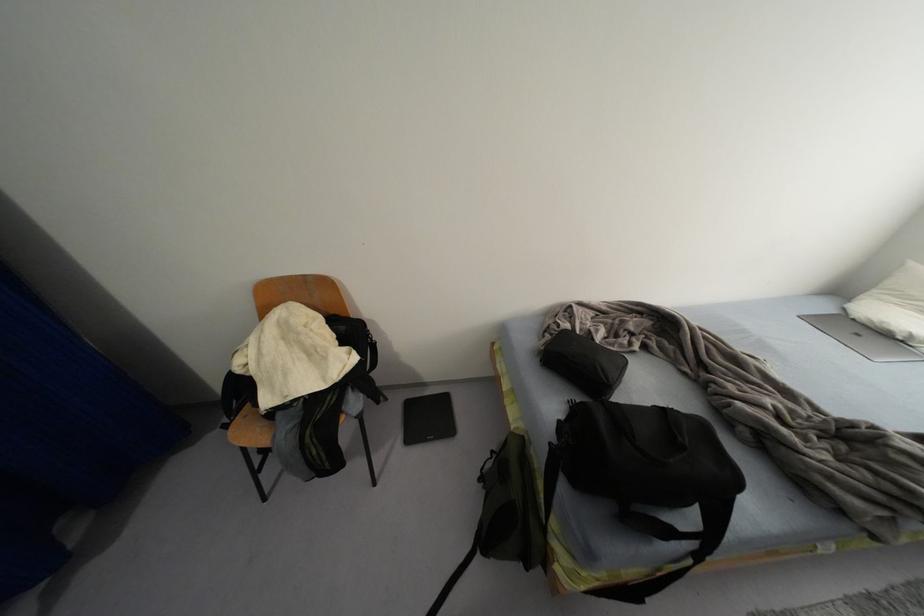
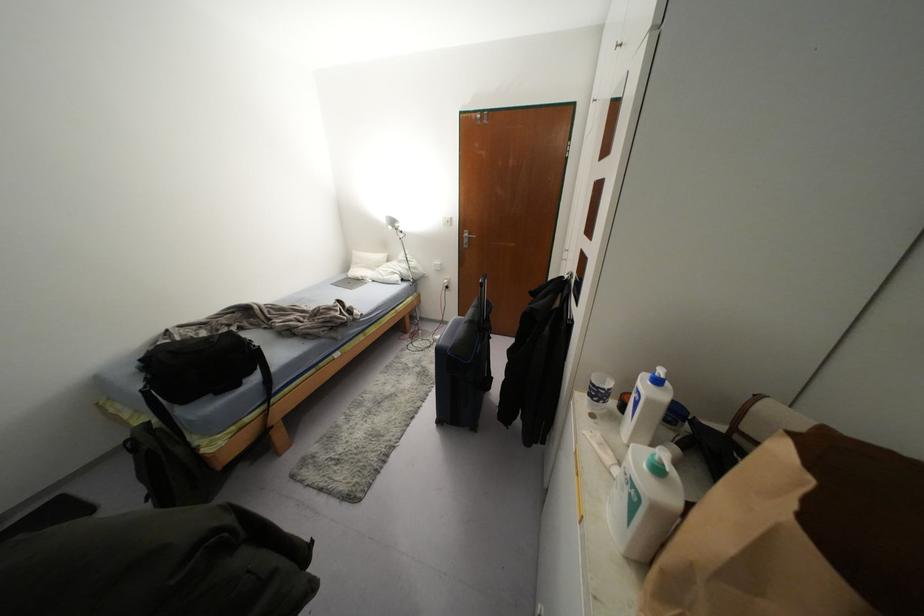
Locate, in the second image, the point that corresponds to (x=882, y=338) in the first image.

(358, 281)